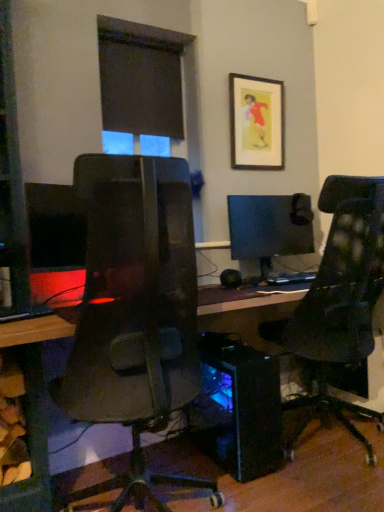
The width and height of the screenshot is (384, 512). What are the coordinates of `vacant space to the right of transparent blue computer tower at center` in the screenshot? It's located at (321, 461).